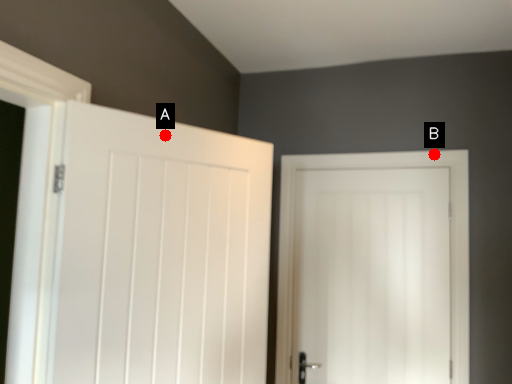
Question: Two points are circled on the image, labeled by A and B beside each circle. Among these points, which one is nearest to the camera?

Choices:
 (A) A is closer
 (B) B is closer

Answer: (A)